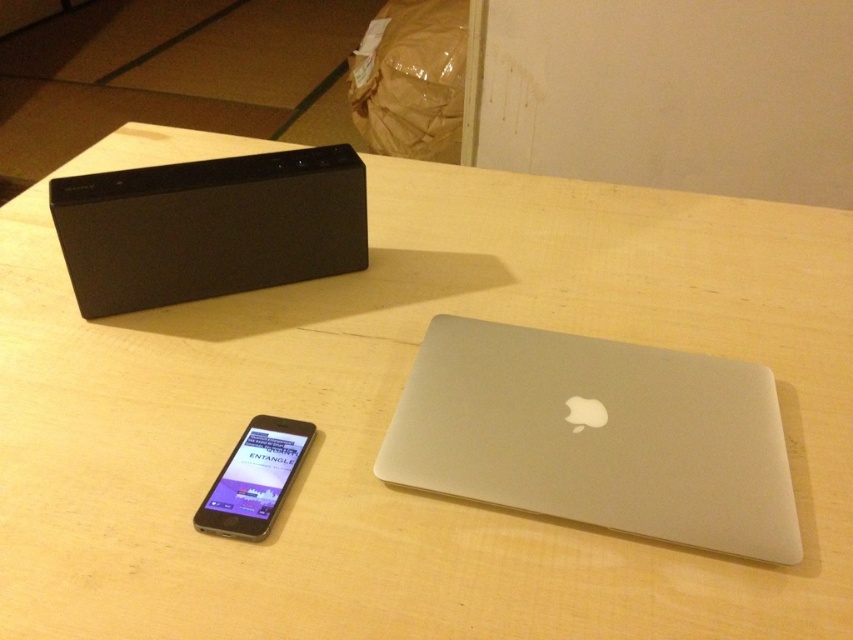
You are organizing items on a table and need to place a new item between the sleek silver laptop at center and the satin black ipod at lower left. Based on their positions, which item is closer to you, and where should you place the new item?

The sleek silver laptop at center is closer to the viewer than the satin black ipod at lower left. To place the new item between them, position it closer to the satin black ipod at lower left since the laptop is nearer to you.

You are a delivery robot positioned at the center of the table. You need to deliver a small package to the point closer to the edge of the table. Which point should you go to, point (x=496, y=429) or point (x=120, y=241)?

Point (x=120, y=241) is closer to the edge of the table, so you should deliver the package to point (x=120, y=241).

Looking at this image, you are organizing items on a table and need to place a new item between the black matte speaker at upper left and the satin black ipod at lower left. Based on their positions, where should you place the new item?

The satin black ipod at lower left is behind the black matte speaker at upper left, so placing the new item between them would require positioning it in front of the black matte speaker at upper left and behind the satin black ipod at lower left. However, since the ipod is already behind the speaker, there might not be enough space between them for a new item. Consider placing it to the side instead.